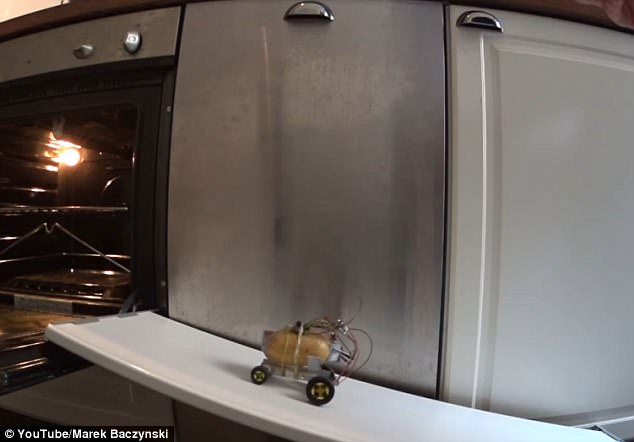
The image size is (634, 442). Identify the location of stainless steel panel. (320, 221).